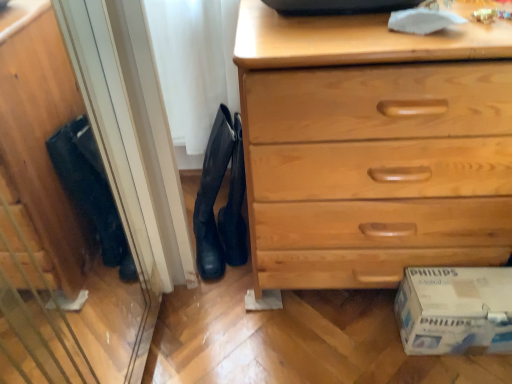
Question: Are white cardboard box at lower right and black suede boot at center far apart?

Choices:
 (A) no
 (B) yes

Answer: (A)

Question: From the image's perspective, does white cardboard box at lower right appear lower than black suede boot at center?

Choices:
 (A) no
 (B) yes

Answer: (B)

Question: Can you confirm if white cardboard box at lower right is positioned to the right of black suede boot at center?

Choices:
 (A) no
 (B) yes

Answer: (B)

Question: From a real-world perspective, is white cardboard box at lower right on top of black suede boot at center?

Choices:
 (A) no
 (B) yes

Answer: (A)

Question: Is white cardboard box at lower right closer to the viewer compared to black suede boot at center?

Choices:
 (A) no
 (B) yes

Answer: (B)

Question: Is white cardboard box at lower right turned away from black suede boot at center?

Choices:
 (A) no
 (B) yes

Answer: (A)

Question: Is light wood chest of drawers at lower right further to camera compared to white cardboard box at lower right?

Choices:
 (A) no
 (B) yes

Answer: (A)

Question: Can you confirm if light wood chest of drawers at lower right is shorter than white cardboard box at lower right?

Choices:
 (A) yes
 (B) no

Answer: (B)

Question: Is light wood chest of drawers at lower right oriented towards white cardboard box at lower right?

Choices:
 (A) yes
 (B) no

Answer: (A)

Question: From the image's perspective, would you say light wood chest of drawers at lower right is positioned over white cardboard box at lower right?

Choices:
 (A) yes
 (B) no

Answer: (A)

Question: Is light wood chest of drawers at lower right positioned beyond the bounds of white cardboard box at lower right?

Choices:
 (A) no
 (B) yes

Answer: (B)

Question: Is light wood chest of drawers at lower right at the right side of white cardboard box at lower right?

Choices:
 (A) no
 (B) yes

Answer: (A)

Question: Considering the relative sizes of black suede boot at center and black leather boots at center in the image provided, is black suede boot at center taller than black leather boots at center?

Choices:
 (A) no
 (B) yes

Answer: (B)